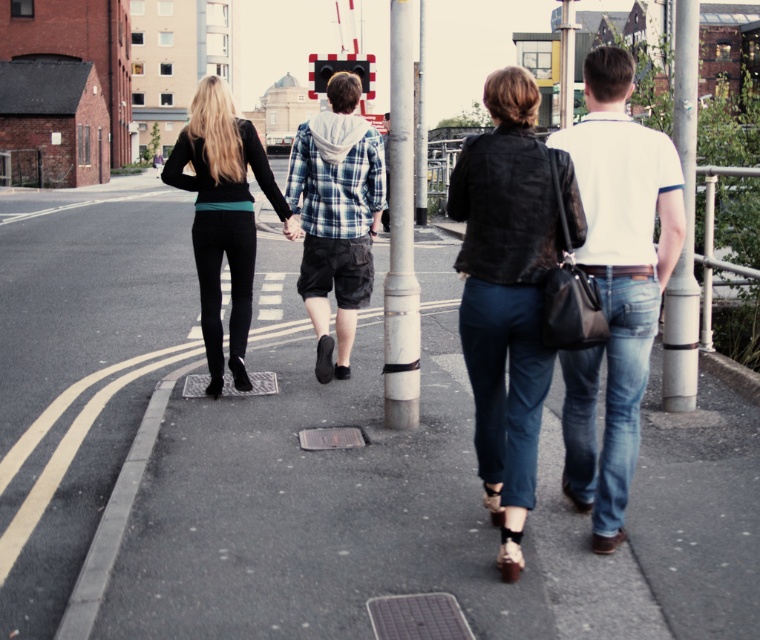
Question: Which object appears closest to the camera in this image?

Choices:
 (A) black matte leggings at left
 (B) metallic pole at center
 (C) white painted metal pole at center
 (D) leather jacket at center

Answer: (D)

Question: Which point is closer to the camera?

Choices:
 (A) (675, 493)
 (B) (667, 333)
 (C) (309, 172)

Answer: (A)

Question: Which of the following is the closest to the observer?

Choices:
 (A) pyautogui.click(x=214, y=244)
 (B) pyautogui.click(x=524, y=326)
 (C) pyautogui.click(x=597, y=518)
 (D) pyautogui.click(x=320, y=227)

Answer: (B)

Question: Can you confirm if leather jacket at center is positioned to the left of white painted metal pole at center?

Choices:
 (A) no
 (B) yes

Answer: (A)

Question: Can you confirm if white painted metal pole at center is bigger than white plastic pole at right?

Choices:
 (A) yes
 (B) no

Answer: (B)

Question: Is smooth asphalt road at center below leather jacket at center?

Choices:
 (A) no
 (B) yes

Answer: (A)